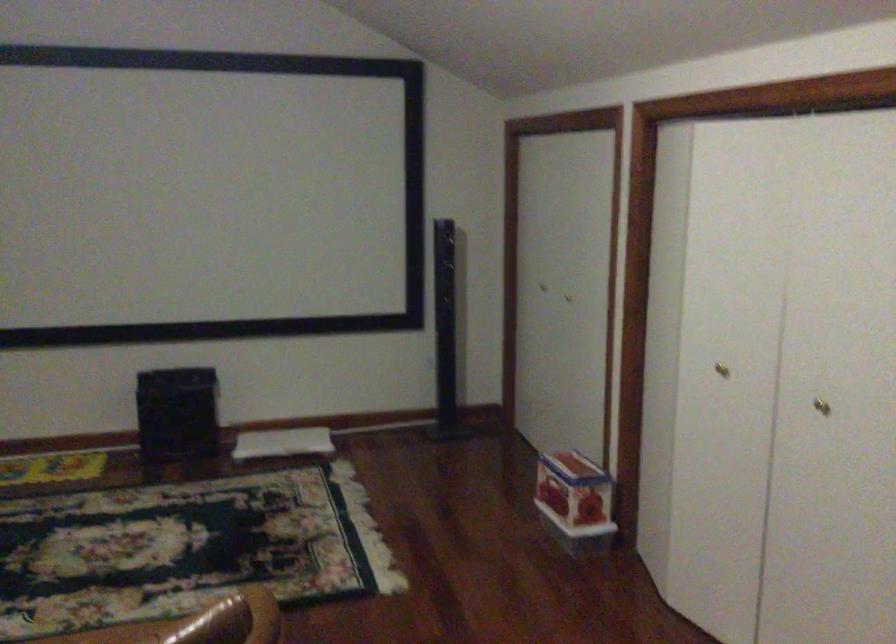
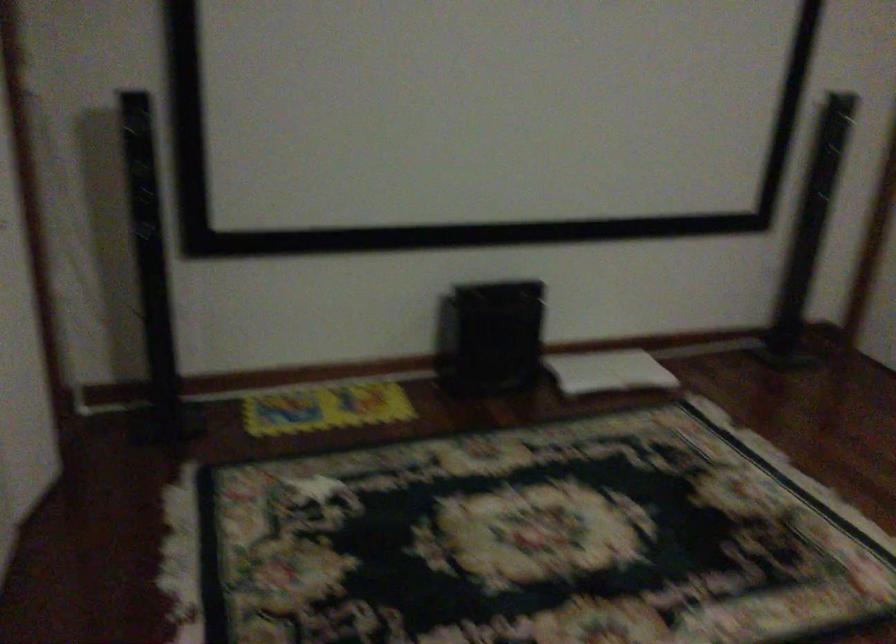
In a continuous first-person perspective shot, in which direction is the camera moving?

The cameraman walked toward left, forward.